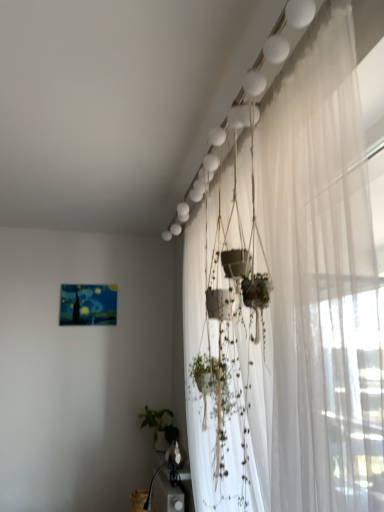
Question: Should I look upward or downward to see white sheer curtain at upper right?

Choices:
 (A) down
 (B) up

Answer: (A)

Question: Is green matte plant at lower center facing towards white sheer curtain at upper right?

Choices:
 (A) yes
 (B) no

Answer: (B)

Question: From a real-world perspective, is green matte plant at lower center physically above white sheer curtain at upper right?

Choices:
 (A) no
 (B) yes

Answer: (A)

Question: Considering the relative positions of green matte plant at lower center and white sheer curtain at upper right in the image provided, is green matte plant at lower center to the right of white sheer curtain at upper right from the viewer's perspective?

Choices:
 (A) yes
 (B) no

Answer: (B)

Question: Is the position of green matte plant at lower center more distant than that of white sheer curtain at upper right?

Choices:
 (A) yes
 (B) no

Answer: (A)

Question: Is white sheer curtain at upper right a part of green matte plant at lower center?

Choices:
 (A) yes
 (B) no

Answer: (B)

Question: Is green matte plant at lower center not near white sheer curtain at upper right?

Choices:
 (A) yes
 (B) no

Answer: (A)

Question: Could green matte plant at lower center be considered to be inside white sheer curtain at upper right?

Choices:
 (A) no
 (B) yes

Answer: (A)

Question: Is white sheer curtain at upper right in contact with green matte plant at lower center?

Choices:
 (A) yes
 (B) no

Answer: (B)

Question: Does white sheer curtain at upper right have a greater width compared to green matte plant at lower center?

Choices:
 (A) yes
 (B) no

Answer: (A)

Question: Does white sheer curtain at upper right appear on the left side of green matte plant at lower center?

Choices:
 (A) yes
 (B) no

Answer: (B)

Question: Considering the relative sizes of white sheer curtain at upper right and green matte plant at lower center in the image provided, is white sheer curtain at upper right bigger than green matte plant at lower center?

Choices:
 (A) yes
 (B) no

Answer: (A)

Question: Could you tell me if white sheer curtain at upper right is facing green matte plant at lower center?

Choices:
 (A) yes
 (B) no

Answer: (B)

Question: Based on their sizes in the image, would you say white sheer curtain at upper right is bigger or smaller than green matte plant at lower center?

Choices:
 (A) small
 (B) big

Answer: (B)